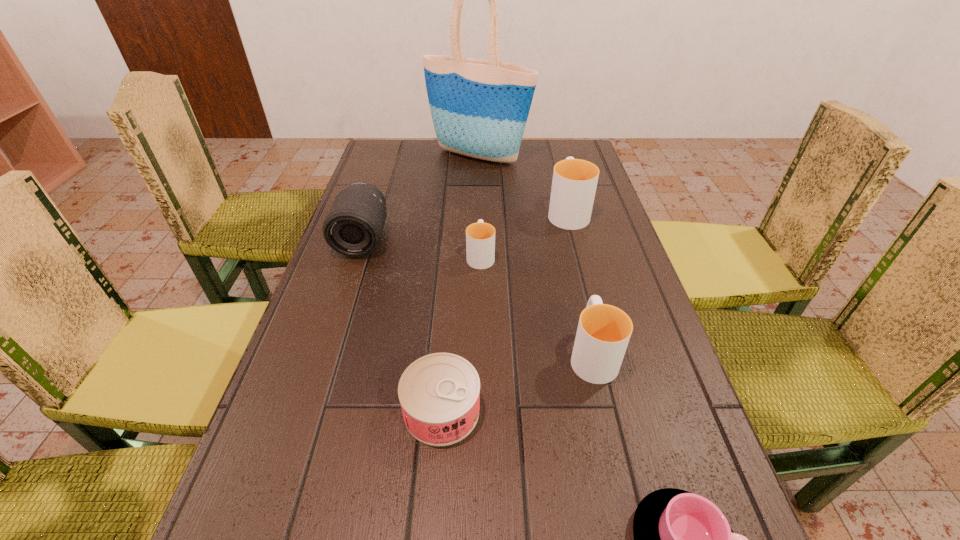
The width and height of the screenshot is (960, 540). In order to click on free region located 0.130m with the handle on the side of the smallest yellow cup in this screenshot , I will do `click(481, 214)`.

Image resolution: width=960 pixels, height=540 pixels. Find the location of `vacant area situated on the right of the can`. vacant area situated on the right of the can is located at coordinates (553, 410).

This screenshot has height=540, width=960. I want to click on object that is at the far edge, so click(x=479, y=108).

Where is `object at the left edge`? This screenshot has width=960, height=540. object at the left edge is located at coordinates (353, 227).

In the image, there is a desktop. At what (x,y) coordinates should I click in order to perform the action: click on vacant space at the left edge. Please return your answer as a coordinate pair (x, y). This screenshot has height=540, width=960. Looking at the image, I should click on (386, 274).

Locate an element on the screen. The height and width of the screenshot is (540, 960). free space at the right edge of the desktop is located at coordinates (593, 213).

Where is `vacant region at the far left corner`? The height and width of the screenshot is (540, 960). vacant region at the far left corner is located at coordinates (409, 166).

I want to click on free space between the nearest yellow cup and the farthest cup, so click(580, 282).

Find the location of a particular element. This screenshot has width=960, height=540. free spot between the nearest yellow cup and the leftmost cup is located at coordinates (537, 305).

The height and width of the screenshot is (540, 960). Identify the location of free space between the third shortest cup and the third tallest cup. (537, 305).